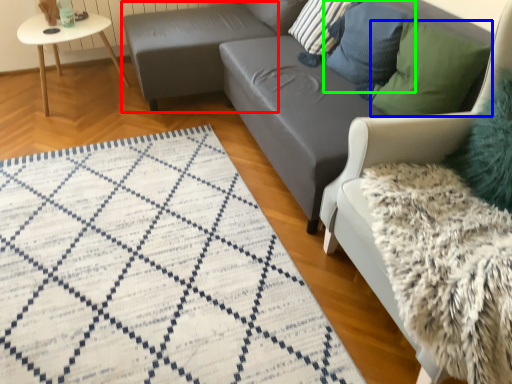
Question: Based on their relative distances, which object is farther from footrest (highlighted by a red box)? Choose from pillow (highlighted by a blue box) and pillow (highlighted by a green box).

Choices:
 (A) pillow
 (B) pillow

Answer: (A)